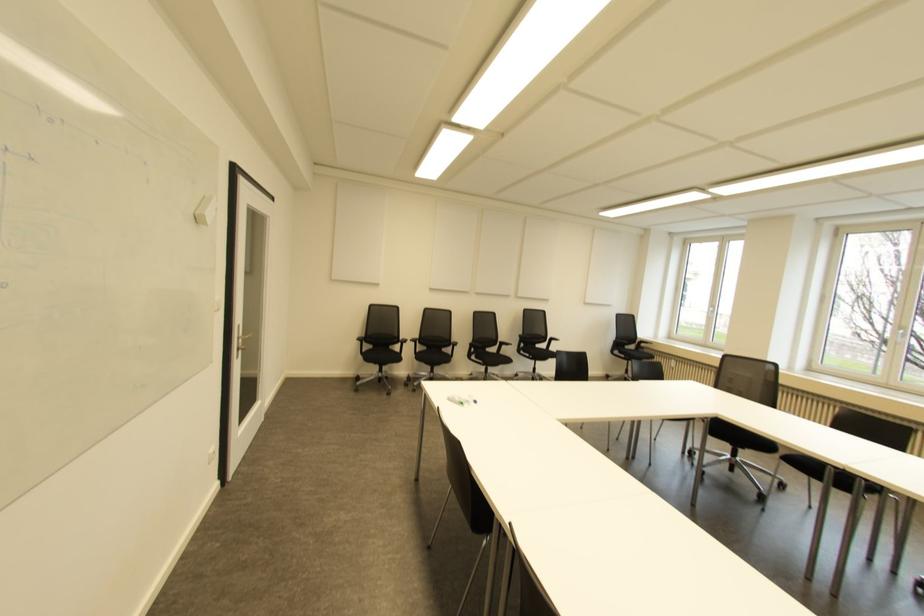
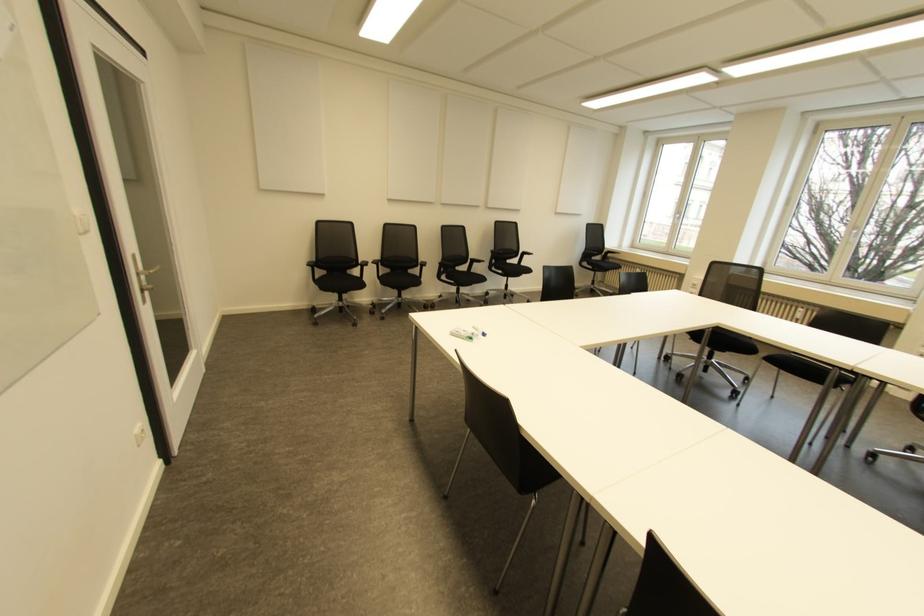
The point at [359,342] is marked in the first image. Where is the corresponding point in the second image?

(310, 268)